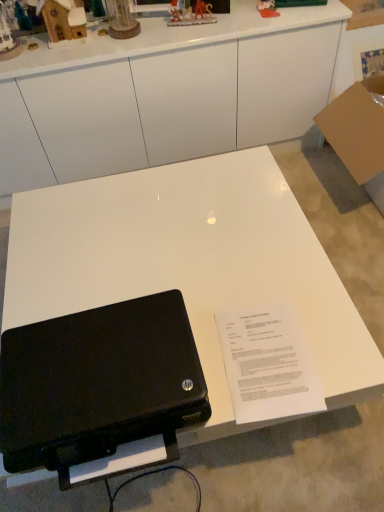
This screenshot has width=384, height=512. I want to click on vacant space in front of matte wooden clock at upper center, the third toy when ordered from left to right, so click(x=122, y=44).